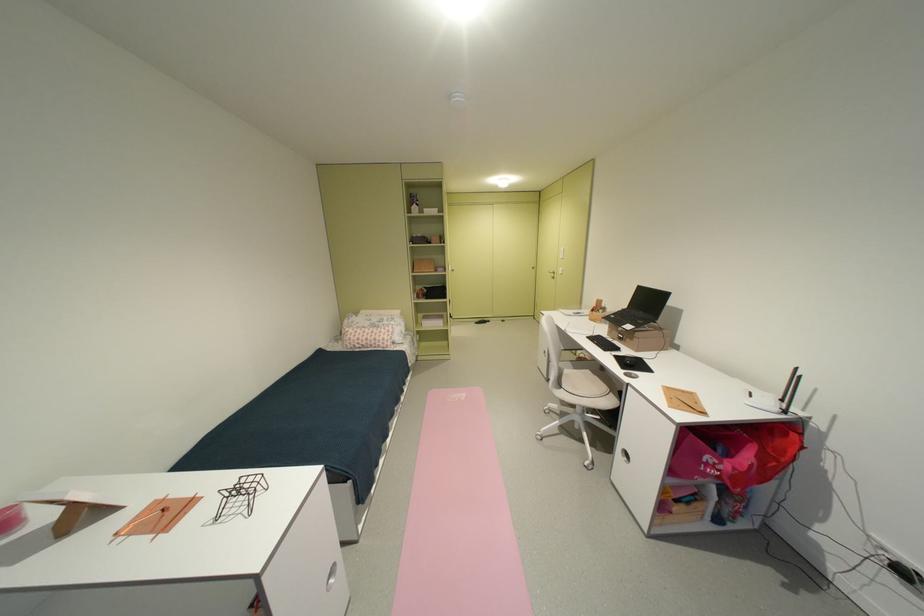
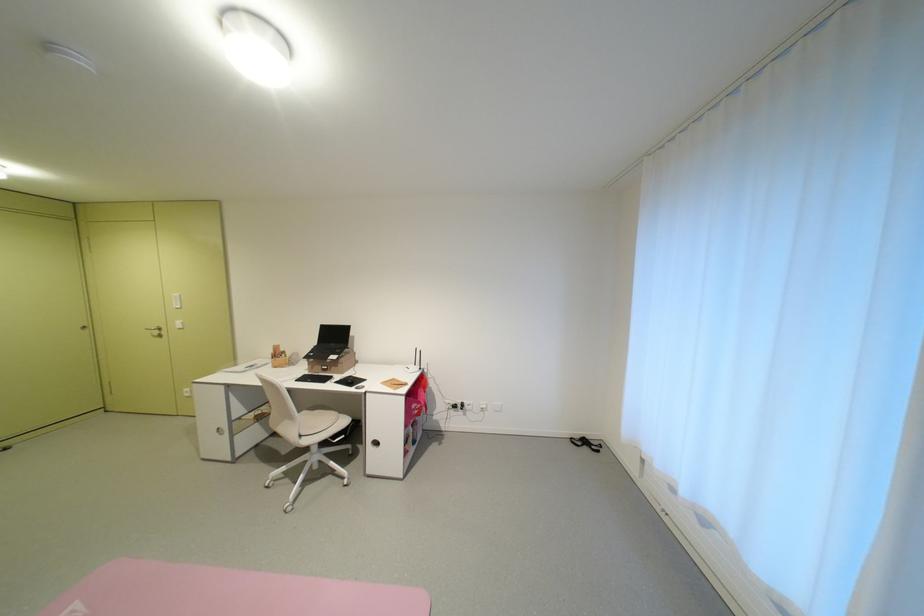
Where in the second image is the point corresponding to the point at 641,341 from the first image?

(346, 368)